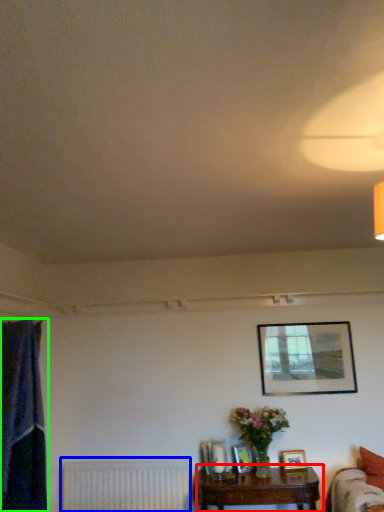
Question: Which is farther away from table (highlighted by a red box)? radiator (highlighted by a blue box) or curtain (highlighted by a green box)?

Choices:
 (A) radiator
 (B) curtain

Answer: (B)